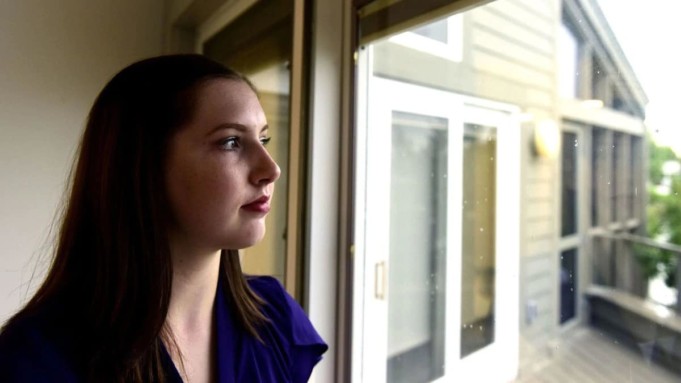
At what (x,y) coordinates should I click in order to perform the action: click on wall. Please return your answer as a coordinate pair (x, y). Looking at the image, I should click on (549, 238).